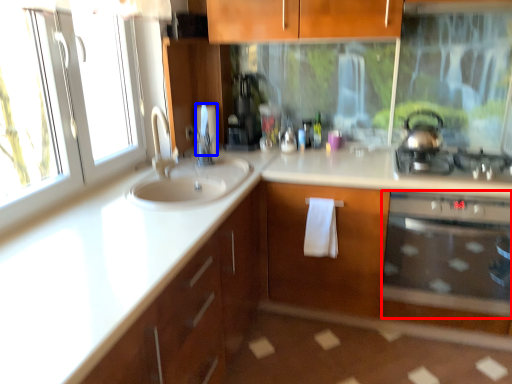
Question: Which of the following is the closest to the observer, oven (highlighted by a red box) or toilet paper (highlighted by a blue box)?

Choices:
 (A) oven
 (B) toilet paper

Answer: (A)